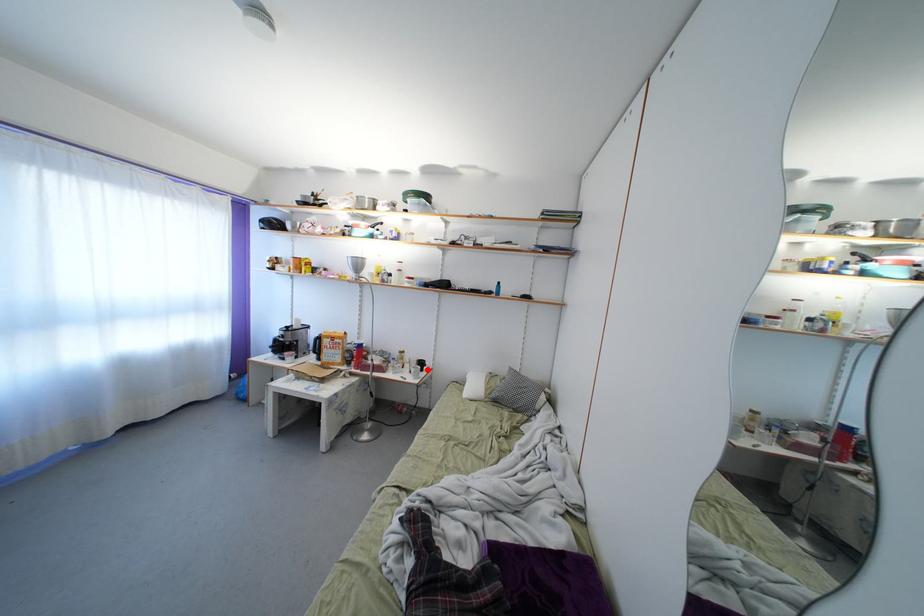
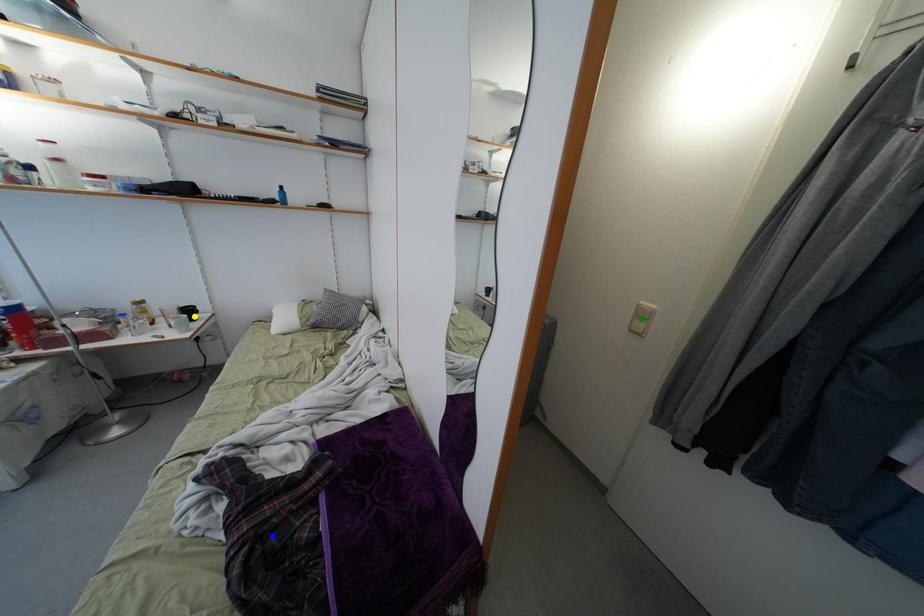
Question: I am providing you with two images of the same scene from different viewpoints. A red point is marked on the first image. You are given multiple points on the second image. Which spot in image 2 lines up with the point in image 1?

Choices:
 (A) yellow point
 (B) blue point
 (C) green point

Answer: (A)